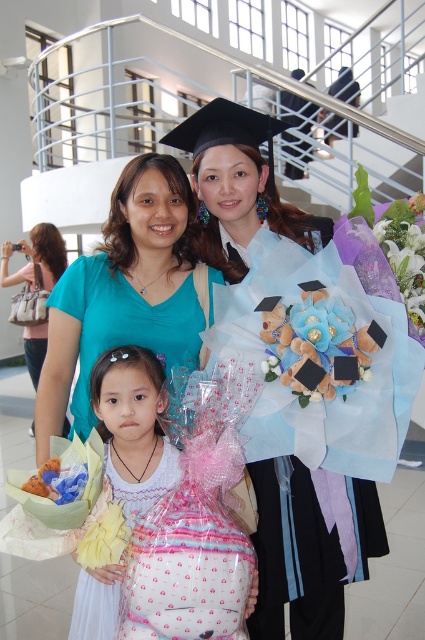
You are organizing a graduation ceremony and need to ensure the graduation gown fits properly. Given the information provided, which object is bigger in size between the matte black graduation gown at center and the pink fabric gift bag at center?

The matte black graduation gown at center is larger in size compared to the pink fabric gift bag at center.

You are a photographer trying to capture a closeup of the pink fabric gift bag at center without the matte black graduation gown at center blocking the view. Can you adjust your angle to achieve this?

The matte black graduation gown at center is above the pink fabric gift bag at center, so if you lower your camera angle slightly, you can position it below the gown to capture the gift bag without obstruction.